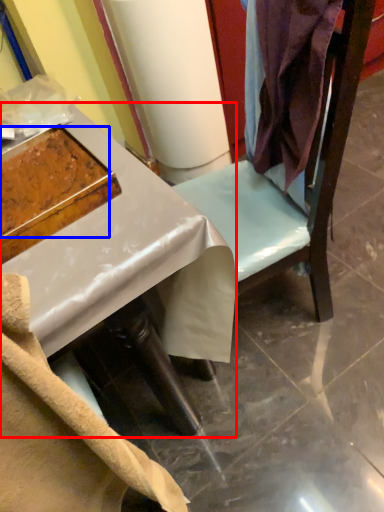
Question: Which object is closer to the camera taking this photo, desk (highlighted by a red box) or food (highlighted by a blue box)?

Choices:
 (A) desk
 (B) food

Answer: (A)